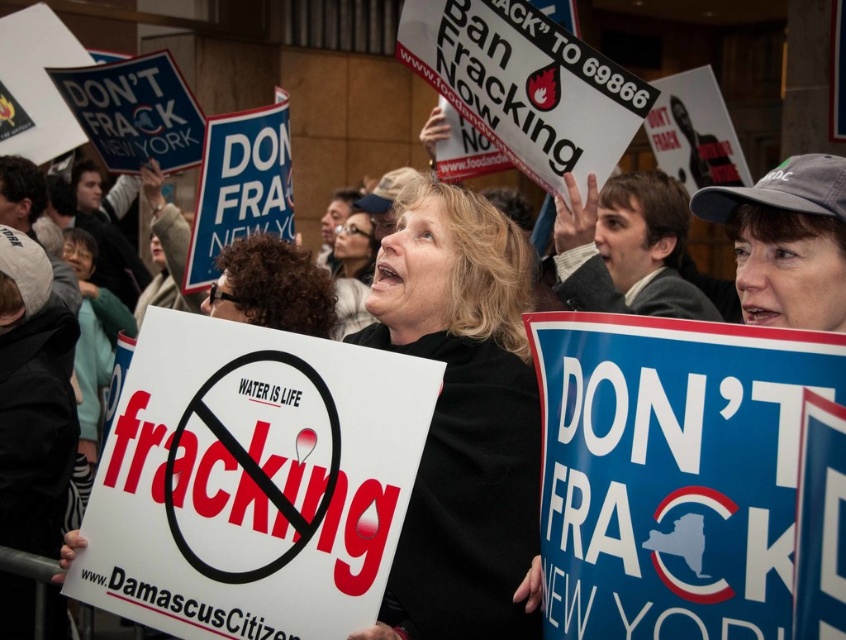
Describe the element at coordinates (673, 472) in the screenshot. I see `blue paper sign at center` at that location.

Is blue paper sign at center taller than black matte sign at center?

Yes, blue paper sign at center is taller than black matte sign at center.

Is point (640, 368) farther from camera compared to point (487, 292)?

No, it is not.

The width and height of the screenshot is (846, 640). I want to click on blue paper sign at center, so click(673, 472).